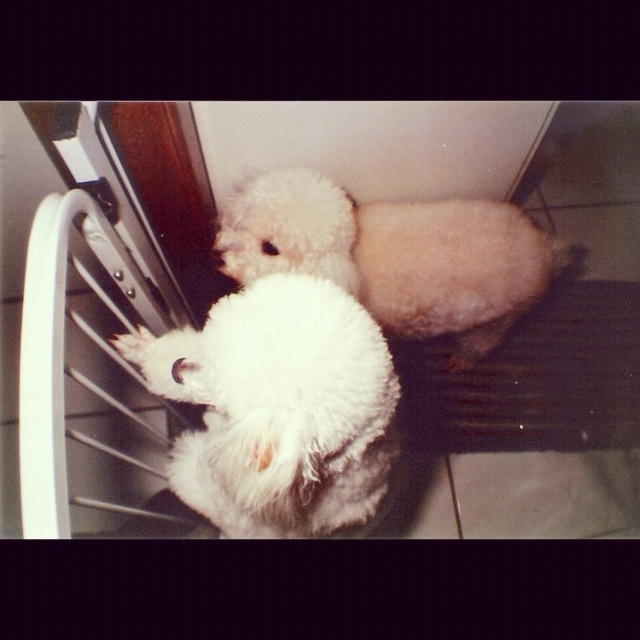
Question: Which of the following is the farthest from the observer?

Choices:
 (A) white fluffy dog at left
 (B) white fluffy paw at lower left
 (C) white fluffy dog at center

Answer: (C)

Question: Is white fluffy dog at center below white fluffy paw at lower left?

Choices:
 (A) yes
 (B) no

Answer: (B)

Question: Which point is closer to the camera?

Choices:
 (A) (282, 435)
 (B) (435, 262)

Answer: (A)

Question: Based on their relative distances, which object is farther from the white fluffy dog at left?

Choices:
 (A) white fluffy paw at lower left
 (B) white fluffy dog at center

Answer: (B)

Question: Is white fluffy dog at left further to camera compared to white fluffy paw at lower left?

Choices:
 (A) yes
 (B) no

Answer: (B)

Question: Is white fluffy dog at left above white fluffy dog at center?

Choices:
 (A) no
 (B) yes

Answer: (A)